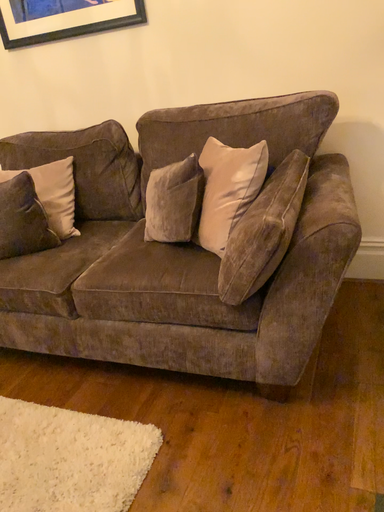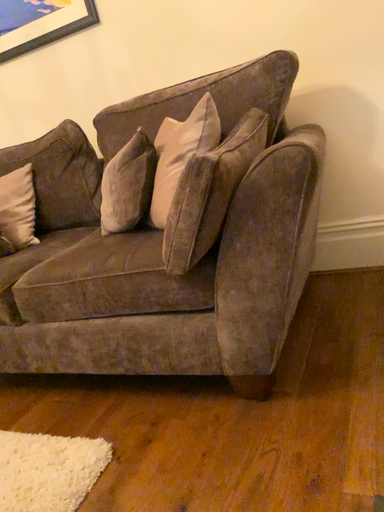
Question: Which way did the camera rotate in the video?

Choices:
 (A) rotated upward
 (B) rotated downward

Answer: (A)